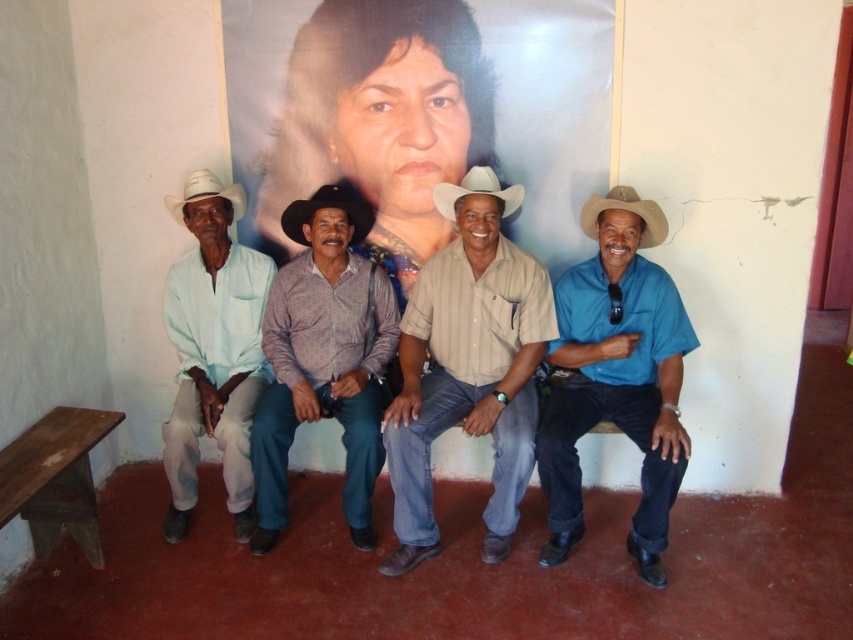
This screenshot has width=853, height=640. What do you see at coordinates (614, 376) in the screenshot?
I see `blue cotton shirt at right` at bounding box center [614, 376].

Is blue cotton shirt at right wider than white matte cowboy hat at left?

Yes.

Identify the location of blue cotton shirt at right. (614, 376).

Find the location of a particular element. beige striped shirt at center is located at coordinates (468, 365).

Is point (547, 323) positioned before point (337, 228)?

That is True.

Locate an element on the screen. Image resolution: width=853 pixels, height=640 pixels. beige striped shirt at center is located at coordinates (468, 365).

Find the location of `brown wooden bench at lower left`. brown wooden bench at lower left is located at coordinates (55, 477).

Is brown wooden bench at lower left shorter than white matte cowboy hat at left?

Incorrect, brown wooden bench at lower left's height does not fall short of white matte cowboy hat at left's.

Between point (16, 499) and point (213, 184), which one is positioned behind?

The point (213, 184) is more distant.

I want to click on brown wooden bench at lower left, so click(55, 477).